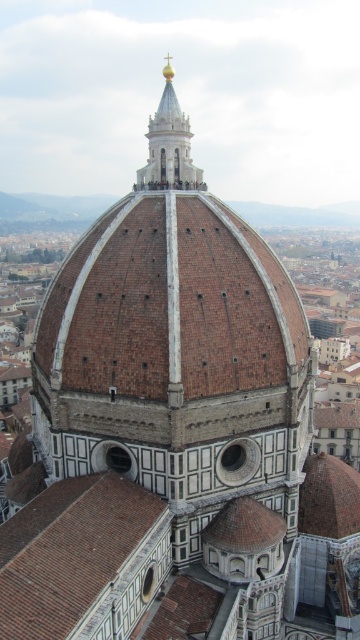
Question: Which of the following is the closest to the observer?

Choices:
 (A) (66, 630)
 (B) (165, 145)

Answer: (A)

Question: Among these objects, which one is farthest from the camera?

Choices:
 (A) brown tile roof at lower left
 (B) gold polished spire at upper center

Answer: (B)

Question: Is brown tile roof at lower left to the left of gold polished spire at upper center from the viewer's perspective?

Choices:
 (A) yes
 (B) no

Answer: (A)

Question: Does brown tile roof at lower left have a lesser width compared to gold polished spire at upper center?

Choices:
 (A) yes
 (B) no

Answer: (B)

Question: Does brown tile roof at lower left appear under gold polished spire at upper center?

Choices:
 (A) yes
 (B) no

Answer: (A)